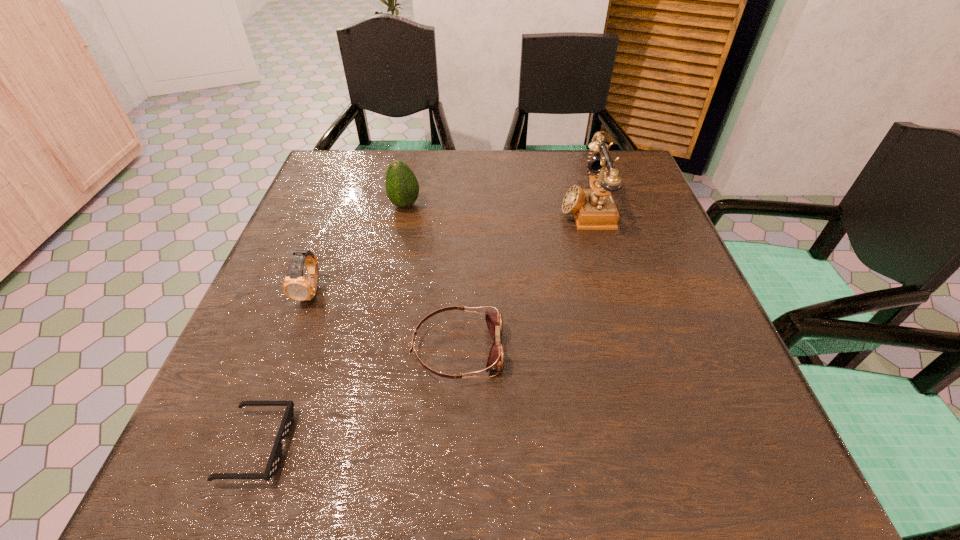
Identify the location of vacant space located on the dial number of the telephone. The height and width of the screenshot is (540, 960). (458, 208).

Locate an element on the screen. blank space located 0.220m on the dial number of the telephone is located at coordinates (470, 208).

Locate an element on the screen. The height and width of the screenshot is (540, 960). blank space located 0.160m on the dial number of the telephone is located at coordinates (494, 208).

Find the location of a particular element. The height and width of the screenshot is (540, 960). vacant region located on the front of the avocado is located at coordinates tap(378, 335).

Identify the location of vacant area situated on the face of the third farthest object. Image resolution: width=960 pixels, height=540 pixels. (287, 356).

Locate an element on the screen. vacant space situated through the lenses of the fourth tallest object is located at coordinates (542, 349).

Locate an element on the screen. free space located on the front-facing side of the nearest object is located at coordinates (480, 446).

Find the location of a particular element. This screenshot has height=540, width=960. telephone situated at the far edge is located at coordinates (594, 209).

I want to click on avocado that is positioned at the far edge, so click(x=402, y=188).

You are a GUI agent. You are given a task and a screenshot of the screen. Output one action in this format:
    pyautogui.click(x=<x>, y=<y>)
    Task: Click on the object that is at the near edge
    The height and width of the screenshot is (540, 960).
    Given the screenshot: What is the action you would take?
    pyautogui.click(x=275, y=458)